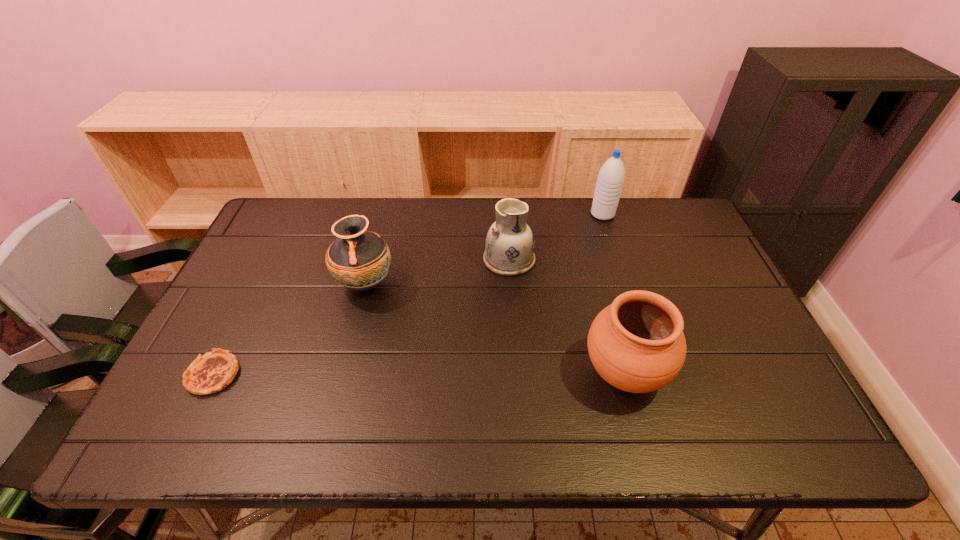
At what (x,y) coordinates should I click in order to perform the action: click on blank area located 0.090m on the right of the leftmost object. Please return your answer as a coordinate pair (x, y). Looking at the image, I should click on (276, 375).

I want to click on water bottle present at the far edge, so click(611, 176).

You are a GUI agent. You are given a task and a screenshot of the screen. Output one action in this format:
    pyautogui.click(x=<x>, y=<y>)
    Task: Click on the pottery situated at the far edge
    
    Given the screenshot: What is the action you would take?
    pyautogui.click(x=509, y=246)

Locate an element on the screen. object that is positioned at the near edge is located at coordinates (636, 344).

The width and height of the screenshot is (960, 540). What are the coordinates of `object present at the left edge` in the screenshot? It's located at (214, 371).

At what (x,y) coordinates should I click in order to perform the action: click on vacant space at the far edge. Please return your answer as a coordinate pair (x, y). Image resolution: width=960 pixels, height=540 pixels. Looking at the image, I should click on (309, 243).

Where is `free spot at the near edge of the desktop`? The height and width of the screenshot is (540, 960). free spot at the near edge of the desktop is located at coordinates (359, 442).

At what (x,y) coordinates should I click in order to perform the action: click on vacant space at the left edge. Please return your answer as a coordinate pair (x, y). The image size is (960, 540). Looking at the image, I should click on (259, 286).

In the image, there is a desktop. At what (x,y) coordinates should I click in order to perform the action: click on free space at the right edge. Please return your answer as a coordinate pair (x, y). Looking at the image, I should click on (706, 255).

In the image, there is a desktop. At what (x,y) coordinates should I click in order to perform the action: click on free space at the far left corner. Please return your answer as a coordinate pair (x, y). Looking at the image, I should click on (280, 202).